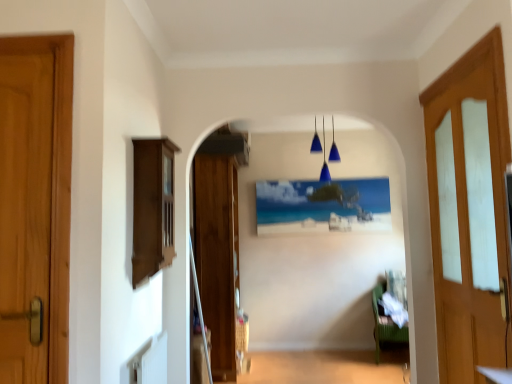
Question: From the image's perspective, is wooden door at left, which is the third door from right to left, over wooden door at center, the second door viewed from the right?

Choices:
 (A) no
 (B) yes

Answer: (B)

Question: Considering the relative sizes of wooden door at left, which is the third door from right to left, and wooden door at center, the third door from the front, in the image provided, is wooden door at left, which is the third door from right to left, smaller than wooden door at center, the third door from the front,?

Choices:
 (A) no
 (B) yes

Answer: (B)

Question: Is wooden door at left, which is the third door from right to left, bigger than wooden door at center, the third door from the front?

Choices:
 (A) yes
 (B) no

Answer: (B)

Question: Does wooden door at left, which is the third door from right to left, have a lesser width compared to wooden door at center, which is the second door from left to right?

Choices:
 (A) yes
 (B) no

Answer: (A)

Question: Does wooden door at left, which is the third door from right to left, turn towards wooden door at center, the third door from the front?

Choices:
 (A) no
 (B) yes

Answer: (A)

Question: Considering the relative positions of wooden door at left, which is the 1th door from left to right, and wooden door at center, which is the second door from left to right, in the image provided, is wooden door at left, which is the 1th door from left to right, in front of wooden door at center, which is the second door from left to right,?

Choices:
 (A) no
 (B) yes

Answer: (B)

Question: Is the depth of matte plastic picture frame at center greater than that of brown wood cabinet at left?

Choices:
 (A) no
 (B) yes

Answer: (B)

Question: Is matte plastic picture frame at center oriented away from brown wood cabinet at left?

Choices:
 (A) no
 (B) yes

Answer: (A)

Question: Is matte plastic picture frame at center positioned in front of brown wood cabinet at left?

Choices:
 (A) no
 (B) yes

Answer: (A)

Question: Is brown wood cabinet at left located within matte plastic picture frame at center?

Choices:
 (A) no
 (B) yes

Answer: (A)

Question: Is matte plastic picture frame at center not inside brown wood cabinet at left?

Choices:
 (A) yes
 (B) no

Answer: (A)

Question: Are matte plastic picture frame at center and brown wood cabinet at left far apart?

Choices:
 (A) yes
 (B) no

Answer: (A)

Question: Can you confirm if matte plastic picture frame at center is shorter than wooden door at left, the third door viewed from the back?

Choices:
 (A) no
 (B) yes

Answer: (B)